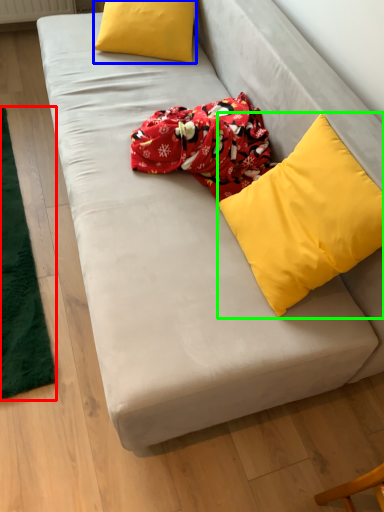
Question: Based on their relative distances, which object is farther from mat (highlighted by a red box)? Choose from pillow (highlighted by a blue box) and pillow (highlighted by a green box).

Choices:
 (A) pillow
 (B) pillow

Answer: (B)